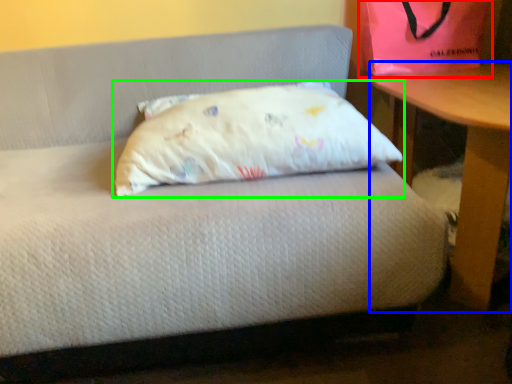
Question: Which is nearer to the bean bag chair (highlighted by a red box)? table (highlighted by a blue box) or pillow (highlighted by a green box).

Choices:
 (A) table
 (B) pillow

Answer: (A)